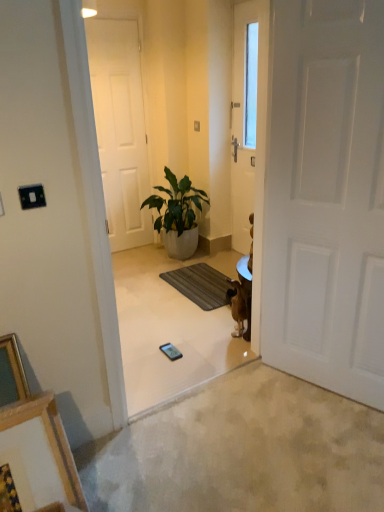
The width and height of the screenshot is (384, 512). I want to click on vacant region below white matte door at right, the second door when ordered from back to front (from a real-world perspective), so click(x=317, y=388).